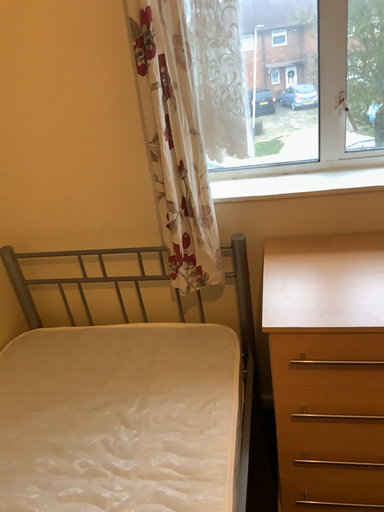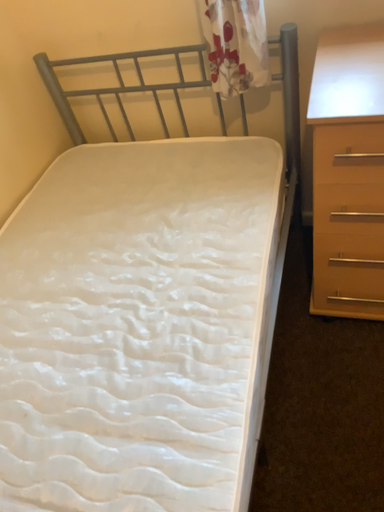
Question: How did the camera likely rotate when shooting the video?

Choices:
 (A) rotated upward
 (B) rotated downward

Answer: (B)